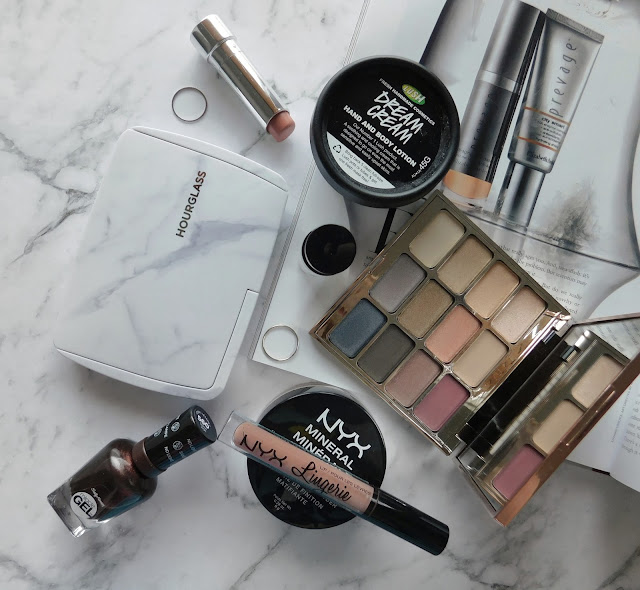
In order to click on gray streaks in countertop in this screenshot , I will do `click(86, 150)`, `click(68, 213)`, `click(508, 545)`, `click(105, 110)`.